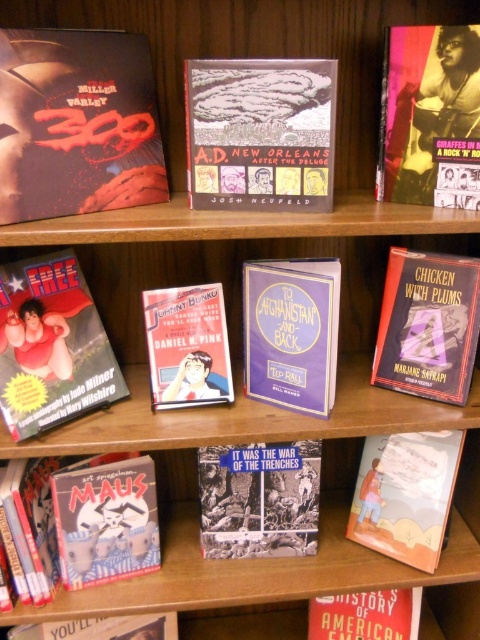
Between black paper book at center and matte paper book at lower right, which one appears on the right side from the viewer's perspective?

matte paper book at lower right

Which of these two, black paper book at center or matte paper book at lower right, stands shorter?

black paper book at center is shorter.

Locate an element on the screen. This screenshot has width=480, height=640. black paper book at center is located at coordinates (259, 499).

At what (x,y) coordinates should I click in order to perform the action: click on black paper book at center. Please return your answer as a coordinate pair (x, y). The height and width of the screenshot is (640, 480). Looking at the image, I should click on (259, 499).

Image resolution: width=480 pixels, height=640 pixels. What do you see at coordinates (431, 116) in the screenshot?
I see `metallic gold guitar at upper right` at bounding box center [431, 116].

Is metallic gold guitar at upper right taller than hardcover book at upper right?

Yes, metallic gold guitar at upper right is taller than hardcover book at upper right.

Is point (392, 29) closer to camera compared to point (452, 196)?

Yes, point (392, 29) is closer to viewer.

You are a GUI agent. You are given a task and a screenshot of the screen. Output one action in this format:
    pyautogui.click(x=<x>, y=<y>)
    Task: Click on the metallic gold guitar at upper right
    
    Given the screenshot: What is the action you would take?
    pyautogui.click(x=431, y=116)

Is black paper book at center taller than hardcover book at upper right?

Yes, black paper book at center is taller than hardcover book at upper right.

Is point (229, 493) positioned in front of point (467, 154)?

No.

Between point (262, 548) and point (462, 170), which one is positioned behind?

Positioned behind is point (262, 548).

Where is `black paper book at center`? This screenshot has width=480, height=640. black paper book at center is located at coordinates (259, 499).